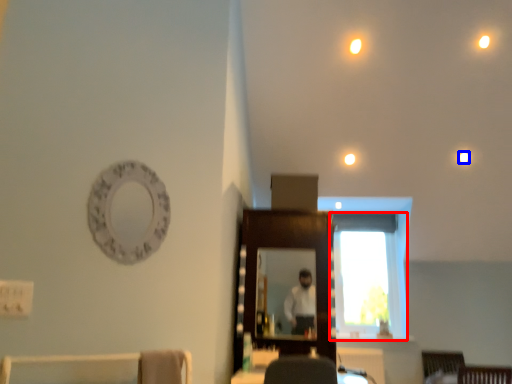
Question: Which object is further to the camera taking this photo, window (highlighted by a red box) or lighting (highlighted by a blue box)?

Choices:
 (A) window
 (B) lighting

Answer: (A)